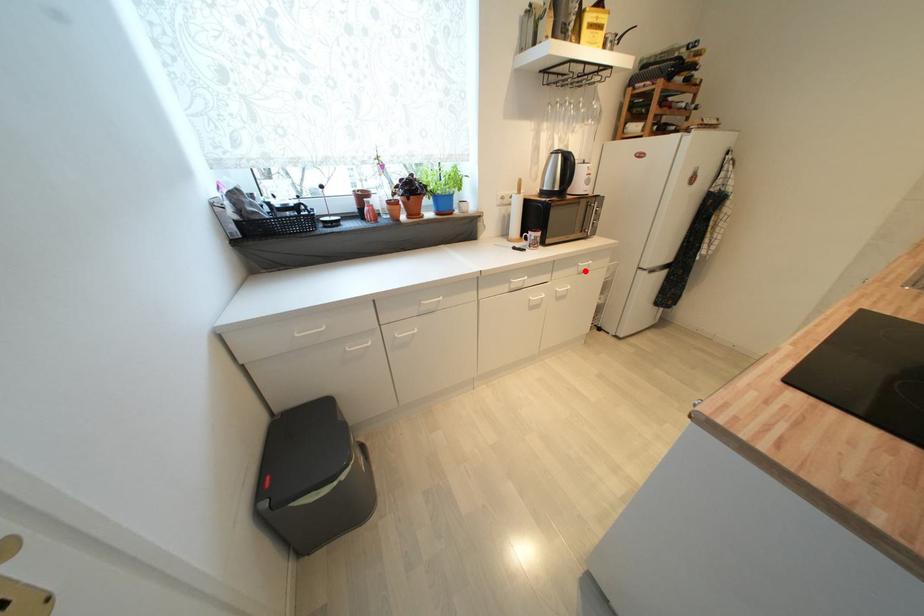
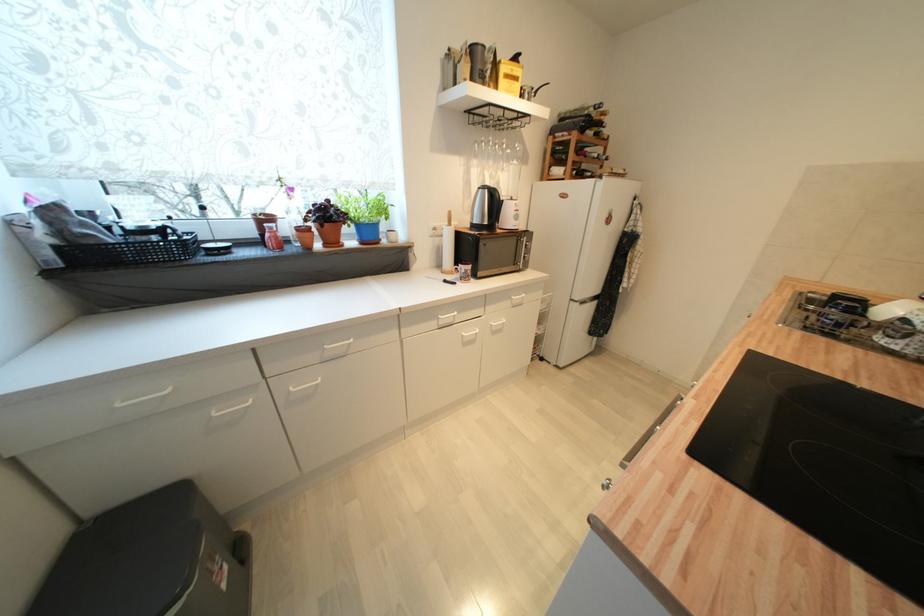
In the second image, find the point that corresponds to the highlighted location in the first image.

(518, 304)